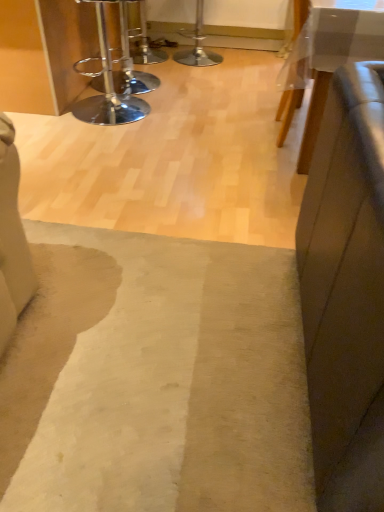
Question: Can you see metallic silver bar stool at upper center touching white glossy table at upper right?

Choices:
 (A) no
 (B) yes

Answer: (A)

Question: From a real-world perspective, is metallic silver bar stool at upper center below white glossy table at upper right?

Choices:
 (A) no
 (B) yes

Answer: (B)

Question: Is metallic silver bar stool at upper center surrounding white glossy table at upper right?

Choices:
 (A) yes
 (B) no

Answer: (B)

Question: Can you confirm if metallic silver bar stool at upper center is thinner than white glossy table at upper right?

Choices:
 (A) yes
 (B) no

Answer: (A)

Question: Would you say metallic silver bar stool at upper center is a long distance from white glossy table at upper right?

Choices:
 (A) yes
 (B) no

Answer: (A)

Question: Is beige woolen mat at center in front of or behind white glossy table at upper right in the image?

Choices:
 (A) behind
 (B) front

Answer: (B)

Question: From a real-world perspective, is beige woolen mat at center physically located above or below white glossy table at upper right?

Choices:
 (A) above
 (B) below

Answer: (B)

Question: Considering the positions of beige woolen mat at center and white glossy table at upper right in the image, is beige woolen mat at center taller or shorter than white glossy table at upper right?

Choices:
 (A) tall
 (B) short

Answer: (B)

Question: Is beige woolen mat at center wider or thinner than white glossy table at upper right?

Choices:
 (A) wide
 (B) thin

Answer: (A)

Question: From a real-world perspective, is chrome/metallic bar stool at upper left positioned above or below beige woolen mat at center?

Choices:
 (A) below
 (B) above

Answer: (B)

Question: In the image, is chrome/metallic bar stool at upper left positioned in front of or behind beige woolen mat at center?

Choices:
 (A) front
 (B) behind

Answer: (B)

Question: Is chrome/metallic bar stool at upper left situated inside beige woolen mat at center or outside?

Choices:
 (A) inside
 (B) outside

Answer: (B)

Question: Looking at their shapes, would you say chrome/metallic bar stool at upper left is wider or thinner than beige woolen mat at center?

Choices:
 (A) wide
 (B) thin

Answer: (B)

Question: From the image's perspective, relative to beige woolen mat at center, is metallic silver bar stool at upper center above or below?

Choices:
 (A) below
 (B) above

Answer: (B)

Question: Would you say metallic silver bar stool at upper center is inside or outside beige woolen mat at center?

Choices:
 (A) outside
 (B) inside

Answer: (A)